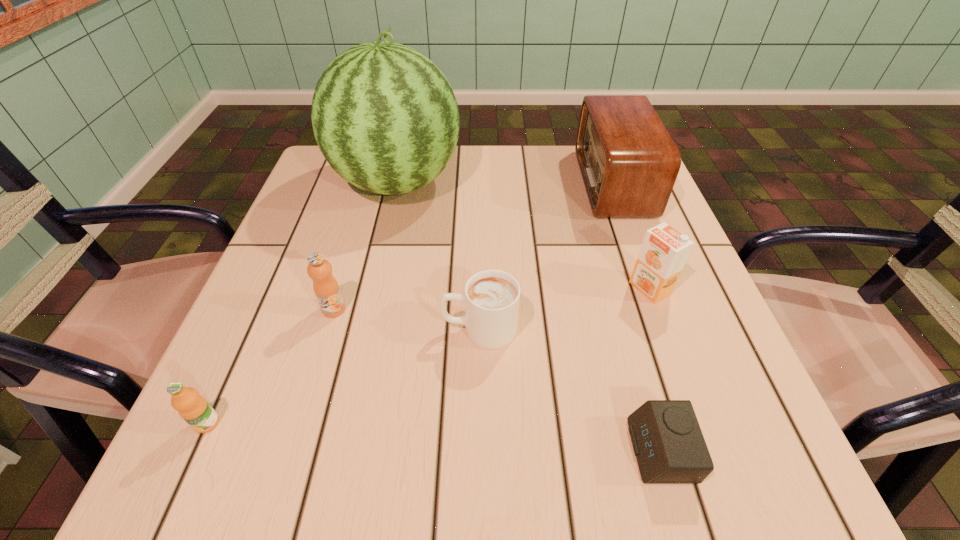
Locate an element on the screen. This screenshot has height=540, width=960. object that is positioned at the far right corner is located at coordinates (629, 163).

Where is `object situated at the near right corner`? The height and width of the screenshot is (540, 960). object situated at the near right corner is located at coordinates (667, 440).

Where is `free space at the far edge of the desktop`? free space at the far edge of the desktop is located at coordinates click(483, 146).

You are a GUI agent. You are given a task and a screenshot of the screen. Output one action in this format:
    pyautogui.click(x=<x>, y=<y>)
    Task: Click on the free location at the left edge of the desktop
    The height and width of the screenshot is (540, 960).
    Given the screenshot: What is the action you would take?
    pyautogui.click(x=304, y=212)

This screenshot has height=540, width=960. In order to click on free region at the right edge of the desktop in this screenshot , I will do [639, 366].

The image size is (960, 540). In the image, there is a desktop. In order to click on vacant space at the far left corner in this screenshot , I will do `click(314, 195)`.

In the image, there is a desktop. Where is `vacant area at the near left corner`? The image size is (960, 540). vacant area at the near left corner is located at coordinates (252, 461).

At what (x,y) coordinates should I click in order to perform the action: click on vacant point located between the nearest orange juice and the watermelon. Please return your answer as a coordinate pair (x, y). Looking at the image, I should click on click(302, 303).

Where is `vacant area between the cappuccino and the tallest object`? The image size is (960, 540). vacant area between the cappuccino and the tallest object is located at coordinates (439, 256).

Locate an element on the screen. vacant area that lies between the shortest orange juice and the second orange juice from left to right is located at coordinates (271, 366).